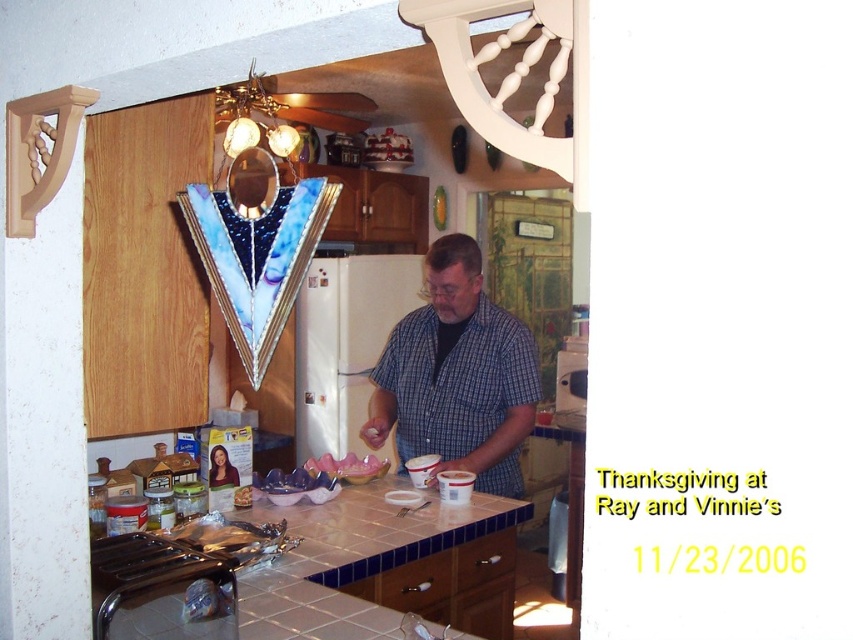
You are standing in the kitchen and want to place a plate on the white tile countertop at center. However, there is a blue plaid shirt at center in your way. Can you reach the countertop without moving the shirt?

The white tile countertop at center is closer to the viewer than the blue plaid shirt at center, so you can reach the countertop without needing to move the shirt.